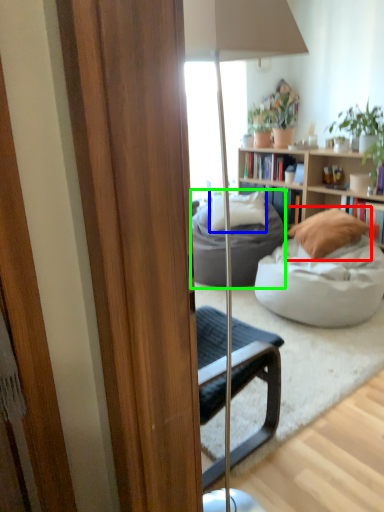
Question: Which is nearer to the pillow (highlighted by a red box)? pillow (highlighted by a blue box) or studio couch (highlighted by a green box).

Choices:
 (A) pillow
 (B) studio couch

Answer: (B)